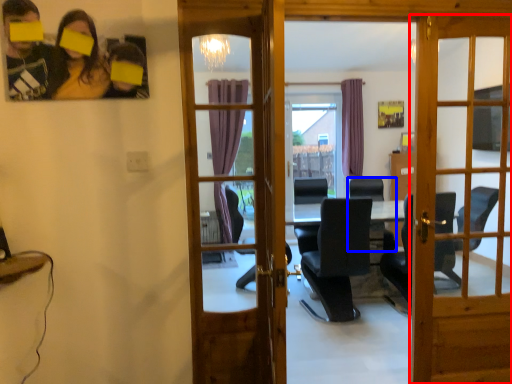
Question: Which of the following is the closest to the observer, door (highlighted by a red box) or chair (highlighted by a blue box)?

Choices:
 (A) door
 (B) chair

Answer: (A)